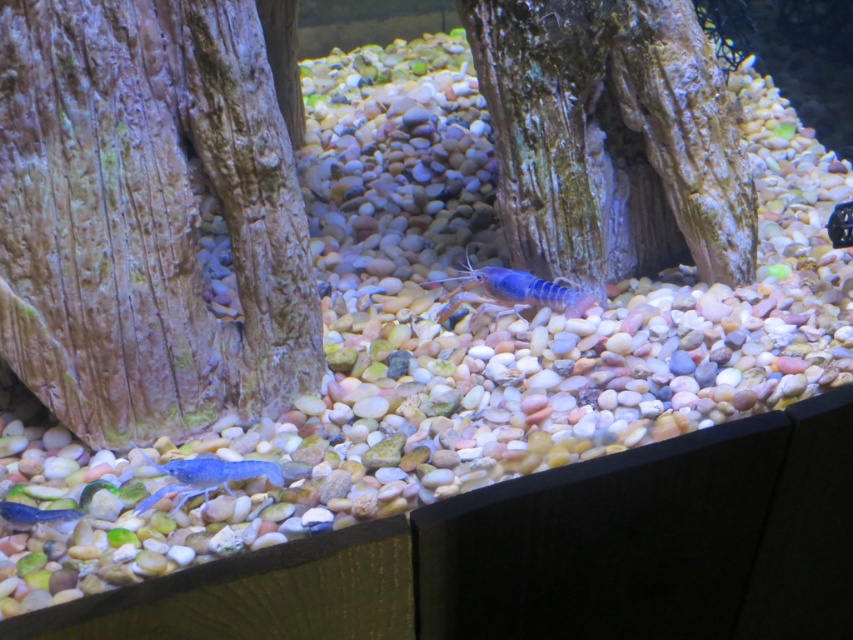
You are observing an aquarium with two blue crayfish marked at specific coordinates. From your perspective, which crayfish is closer to you, the one at point (263, 154) or the one at point (51, 522)?

Point (51, 522) is closer to you since it is in front of point (263, 154) according to their positions.

From the picture: You are a marine biologist observing an aquarium. You notice a blue matte crayfish at center. If you want to observe it closely, can you reach it with a 2.5 meter long net from your current position?

The blue matte crayfish at center is 2.09 meters away from the viewer. Since the net is 2.5 meters long, which is longer than the distance, you can reach it.